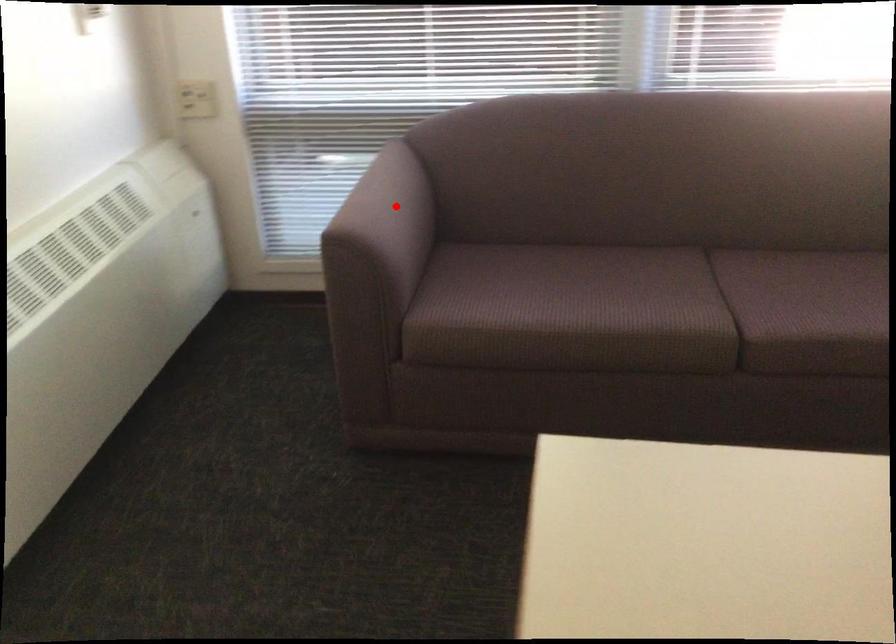
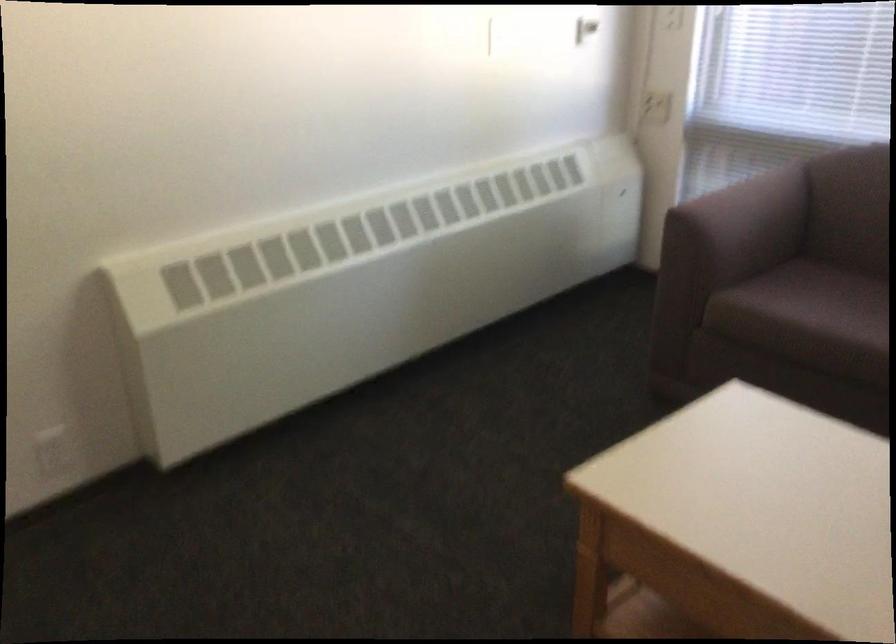
In the second image, find the point that corresponds to the highlighted location in the first image.

(752, 207)